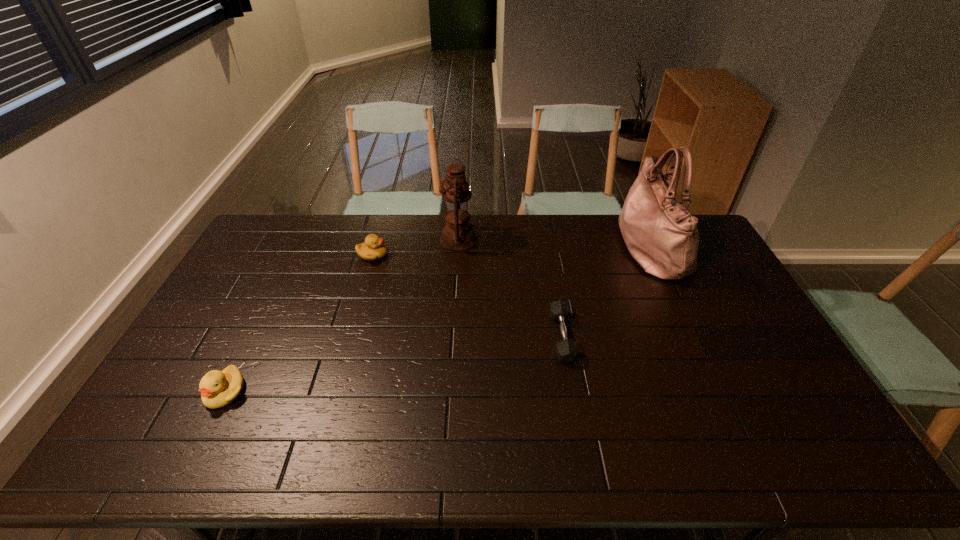
This screenshot has height=540, width=960. What are the coordinates of `vacant space situated 0.260m at the front of the handbag with handles` in the screenshot? It's located at (548, 247).

Find the location of a particular element. vacant space located 0.190m at the front of the handbag with handles is located at coordinates (566, 247).

Identify the location of vacant area located at the front of the handbag with handles. The image size is (960, 540). (520, 247).

I want to click on blank space located 0.080m on the back of the oil lamp, so click(460, 215).

At what (x,y) coordinates should I click in order to perform the action: click on free location located 0.320m at the beak of the second object from left to right. Please return your answer as a coordinate pair (x, y). This screenshot has width=960, height=540. Looking at the image, I should click on (476, 255).

This screenshot has width=960, height=540. I want to click on vacant space located at the face of the nearest object, so click(x=197, y=448).

Where is `vacant space located 0.130m on the right of the shortest object`? vacant space located 0.130m on the right of the shortest object is located at coordinates (614, 336).

Locate an element on the screen. This screenshot has width=960, height=540. handbag that is at the far edge is located at coordinates (661, 234).

Identify the location of oil lamp that is at the far edge. (458, 234).

Find the location of a particular element. The image size is (960, 540). duckling present at the far edge is located at coordinates (373, 248).